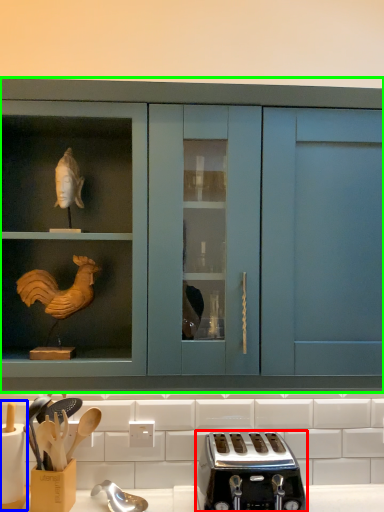
Question: Considering the real-world distances, which object is closest to toaster (highlighted by a red box)? appliance (highlighted by a blue box) or cabinetry (highlighted by a green box).

Choices:
 (A) appliance
 (B) cabinetry

Answer: (B)